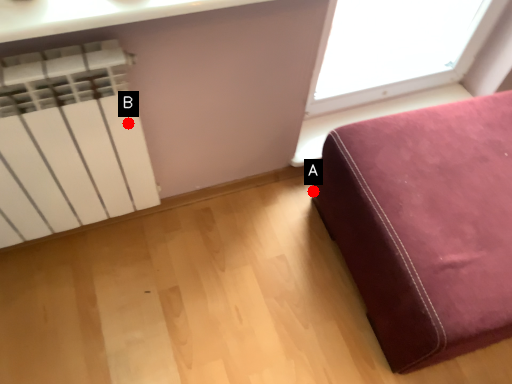
Question: Two points are circled on the image, labeled by A and B beside each circle. Which point is farther from the camera taking this photo?

Choices:
 (A) A is further
 (B) B is further

Answer: (A)